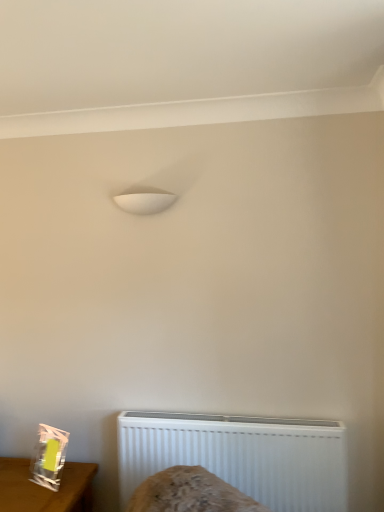
Question: In terms of size, does white plastic radiator at lower center appear bigger or smaller than clear plastic bag at lower left?

Choices:
 (A) small
 (B) big

Answer: (A)

Question: Based on their positions, is white plastic radiator at lower center located to the left or right of clear plastic bag at lower left?

Choices:
 (A) left
 (B) right

Answer: (B)

Question: Considering the positions of white plastic radiator at lower center and clear plastic bag at lower left in the image, is white plastic radiator at lower center taller or shorter than clear plastic bag at lower left?

Choices:
 (A) short
 (B) tall

Answer: (B)

Question: Is clear plastic bag at lower left situated inside white plastic radiator at lower center or outside?

Choices:
 (A) outside
 (B) inside

Answer: (A)

Question: Is clear plastic bag at lower left to the left or to the right of white plastic radiator at lower center in the image?

Choices:
 (A) right
 (B) left

Answer: (B)

Question: From a real-world perspective, is clear plastic bag at lower left physically located above or below white plastic radiator at lower center?

Choices:
 (A) above
 (B) below

Answer: (B)

Question: Based on their sizes in the image, would you say clear plastic bag at lower left is bigger or smaller than white plastic radiator at lower center?

Choices:
 (A) small
 (B) big

Answer: (B)